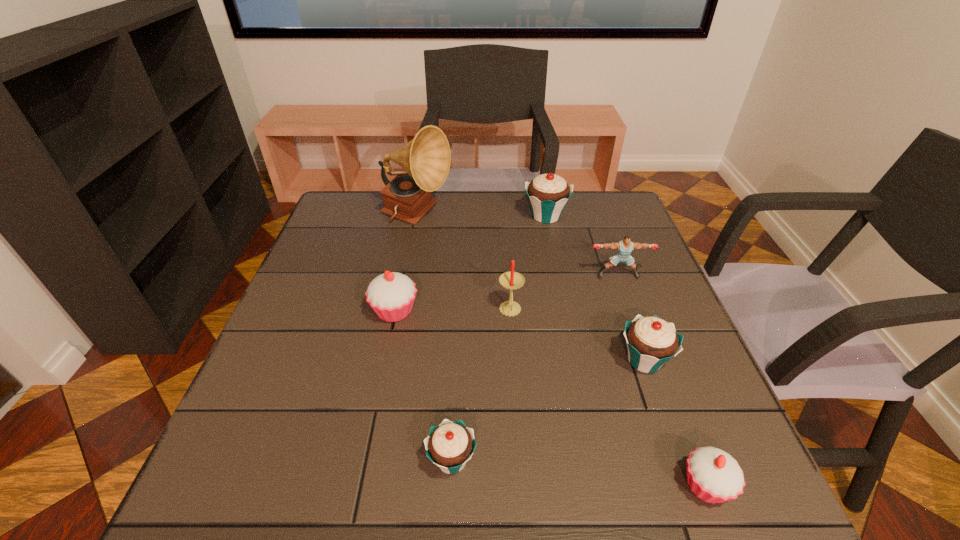
In order to click on free spot located 0.190m on the back of the nearest teal cupcake in this screenshot , I will do `click(457, 355)`.

Where is `vacant space situated on the back of the right pink cupcake`? The image size is (960, 540). vacant space situated on the back of the right pink cupcake is located at coordinates (669, 388).

Where is `phonograph record that is at the far edge`? Image resolution: width=960 pixels, height=540 pixels. phonograph record that is at the far edge is located at coordinates (426, 158).

Where is `cupcake present at the far edge`? The image size is (960, 540). cupcake present at the far edge is located at coordinates (548, 194).

Where is `object situated at the left edge`? This screenshot has width=960, height=540. object situated at the left edge is located at coordinates (426, 158).

At what (x,y) coordinates should I click in order to perform the action: click on puncher situated at the right edge. Please return your answer as a coordinate pair (x, y). This screenshot has width=960, height=540. Looking at the image, I should click on (624, 247).

You are a GUI agent. You are given a task and a screenshot of the screen. Output one action in this format:
    pyautogui.click(x=<x>, y=<y>)
    Task: Click on the object that is positioned at the far left corner
    The height and width of the screenshot is (540, 960).
    Given the screenshot: What is the action you would take?
    pyautogui.click(x=426, y=158)

Find the location of a particular element. object located at the near right corner is located at coordinates (714, 476).

Find the location of a particular element. vacant space at the far edge of the desktop is located at coordinates (473, 217).

The image size is (960, 540). Find the location of `free space at the near edge`. free space at the near edge is located at coordinates (397, 486).